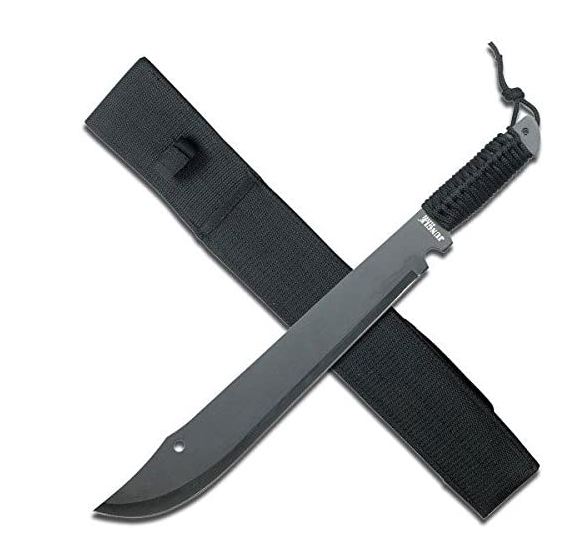
The width and height of the screenshot is (584, 553). In order to click on handle in this screenshot , I will do `click(531, 143)`.